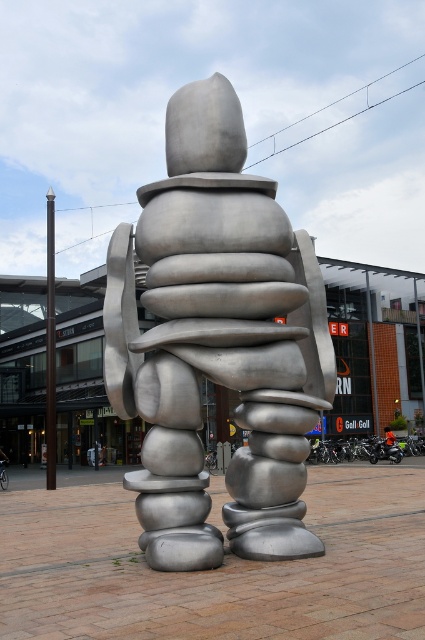
You are an artist planning to photograph both the brushed metal sculpture at center and the orange fabric jacket at center. You want to ensure that the sculpture is the focal point of the image. Based on their sizes, which object should you place closer to the camera to achieve this effect?

The brushed metal sculpture at center is larger than the orange fabric jacket at center. To make the sculpture the focal point, you should place it closer to the camera since its larger size will dominate the frame even when positioned nearer, drawing more attention compared to the smaller jacket placed farther away.

You are standing in the plaza and want to take a photo of the brushed metal mall at center. If your camera has a maximum zoom range of 5 meters, will you need to move closer to capture the entire sculpture in one shot?

The distance of the brushed metal mall at center from camera is 6.32 meters, which is beyond the camera maximum zoom range of 5 meters. You need to move closer to capture the entire sculpture in one shot.

You are standing in the public square and want to take a photo of the brushed metal mall at center. If you are positioned at the origin point, which is the bottom left corner of the square, what are the coordinates of the mall?

The coordinates of the brushed metal mall at center are at point (373, 342).